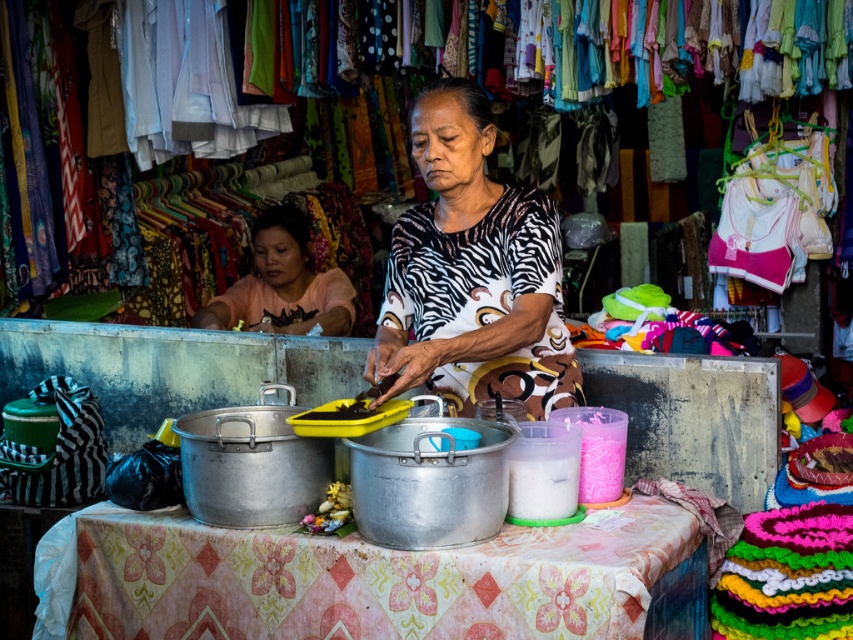
Which of these two, printed fabric blouse at center or black matte food at center, stands taller?

Standing taller between the two is printed fabric blouse at center.

Can you confirm if printed fabric blouse at center is smaller than black matte food at center?

No, printed fabric blouse at center is not smaller than black matte food at center.

Which is behind, point (537, 296) or point (322, 413)?

Point (537, 296)

Locate an element on the screen. The width and height of the screenshot is (853, 640). printed fabric blouse at center is located at coordinates (473, 273).

Between floral-patterned fabric at center and printed fabric blouse at center, which one is positioned lower?

floral-patterned fabric at center

Between floral-patterned fabric at center and printed fabric blouse at center, which one is positioned higher?

Positioned higher is printed fabric blouse at center.

The width and height of the screenshot is (853, 640). Find the location of `floral-patterned fabric at center`. floral-patterned fabric at center is located at coordinates (375, 579).

Who is shorter, printed fabric blouse at center or pink cotton shirt at center?

With less height is pink cotton shirt at center.

Find the location of a particular element. printed fabric blouse at center is located at coordinates (473, 273).

This screenshot has width=853, height=640. Identify the location of printed fabric blouse at center. (473, 273).